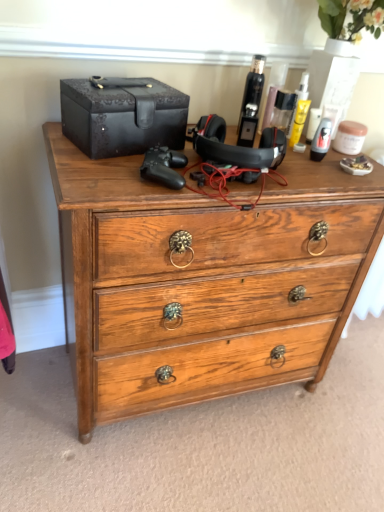
Question: From a real-world perspective, relative to black leather box at upper left, is wooden chest of drawers at center vertically above or below?

Choices:
 (A) above
 (B) below

Answer: (B)

Question: In the image, is wooden chest of drawers at center positioned in front of or behind black leather box at upper left?

Choices:
 (A) behind
 (B) front

Answer: (B)

Question: Which object is positioned farthest from the shiny black bottle at upper right, the 2th toiletry positioned from the left?

Choices:
 (A) wooden chest of drawers at center
 (B) black leather box at upper left
 (C) shiny black hair spray at upper center, the first toiletry from the left

Answer: (A)

Question: Which of these objects is positioned closest to the shiny black hair spray at upper center, which ranks as the 2th toiletry in right-to-left order?

Choices:
 (A) wooden chest of drawers at center
 (B) black leather box at upper left
 (C) shiny black bottle at upper right, which is the 1th toiletry from right to left

Answer: (C)